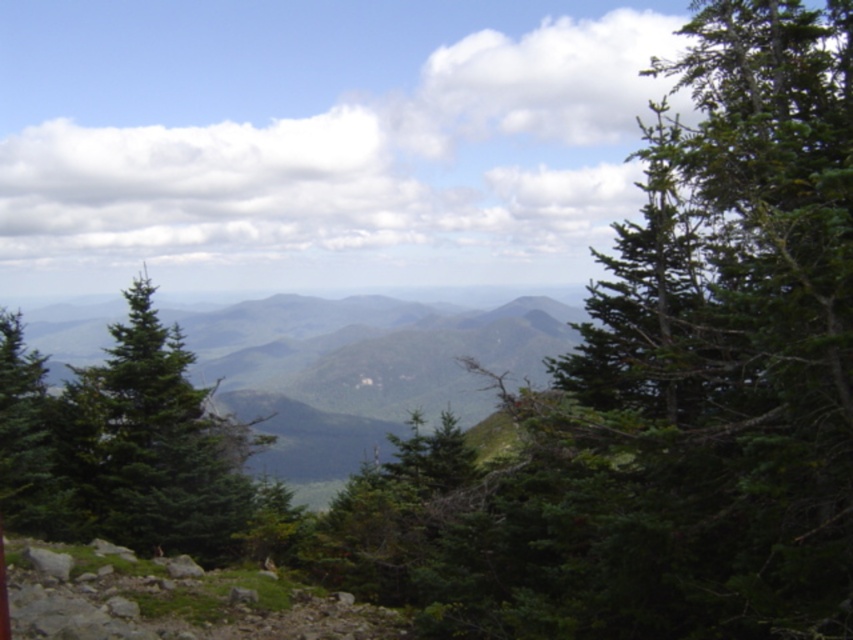
Question: Does green matte tree at center appear on the left side of green matte tree at left?

Choices:
 (A) no
 (B) yes

Answer: (A)

Question: Does green matte tree at center appear over green matte tree at left?

Choices:
 (A) yes
 (B) no

Answer: (B)

Question: Can you confirm if green matte tree at center is positioned to the right of green matte tree at left?

Choices:
 (A) yes
 (B) no

Answer: (A)

Question: Which point is closer to the camera?

Choices:
 (A) (64, 516)
 (B) (13, 448)

Answer: (A)

Question: Which point is farther to the camera?

Choices:
 (A) (80, 429)
 (B) (28, 476)

Answer: (A)

Question: Which of the following is the farthest from the observer?

Choices:
 (A) green matte tree at center
 (B) green matte tree at left

Answer: (A)